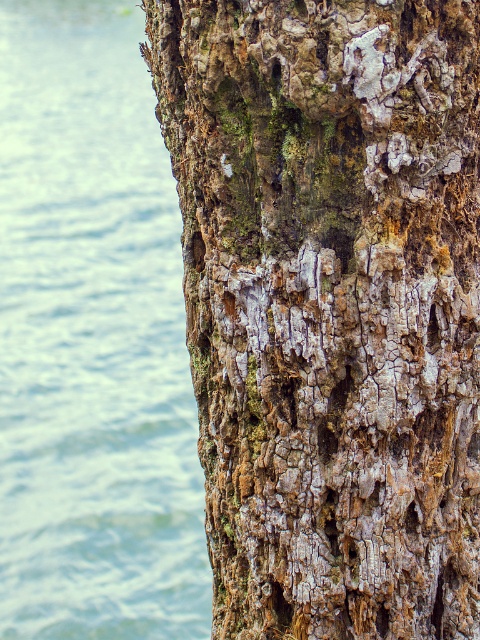
Question: Does cracked bark tree trunk at right appear on the left side of blue water at left?

Choices:
 (A) no
 (B) yes

Answer: (A)

Question: Which point is farther to the camera?

Choices:
 (A) blue water at left
 (B) cracked bark tree trunk at right

Answer: (A)

Question: Is cracked bark tree trunk at right thinner than blue water at left?

Choices:
 (A) no
 (B) yes

Answer: (B)

Question: Does cracked bark tree trunk at right have a lesser width compared to blue water at left?

Choices:
 (A) yes
 (B) no

Answer: (A)